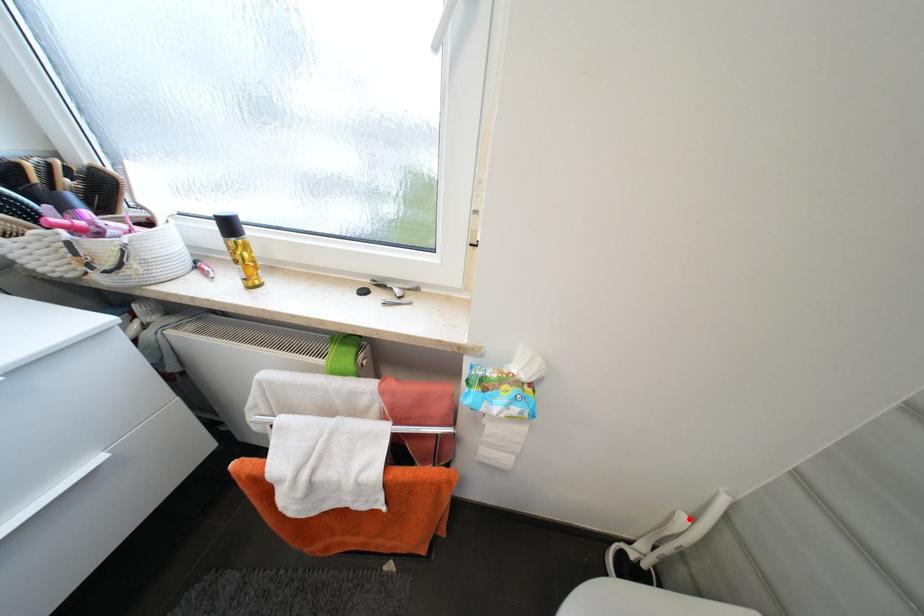
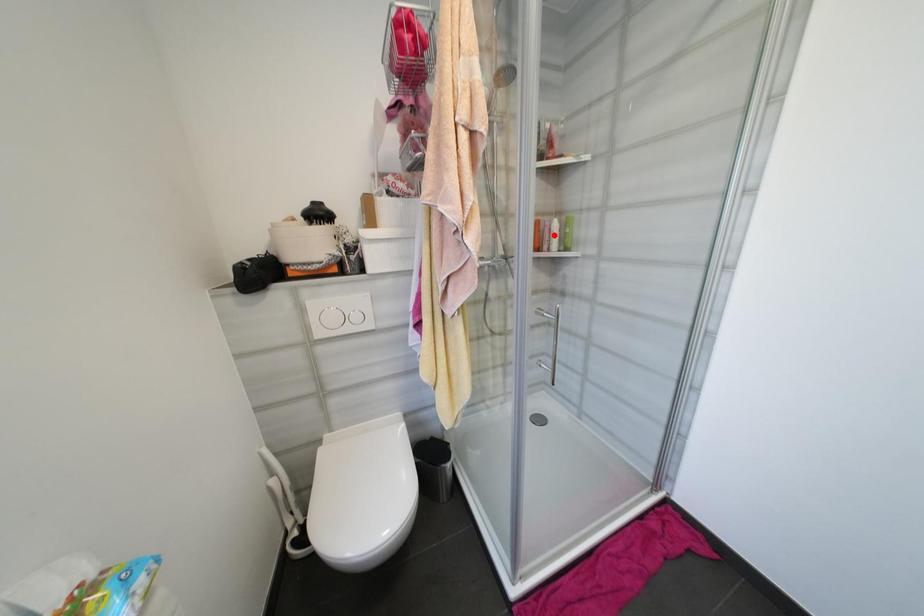
I am providing you with two images of the same scene from different viewpoints. A red point is marked on the first image and another point is marked on the second image. Does the point marked in image1 correspond to the same location as the one in image2?

No